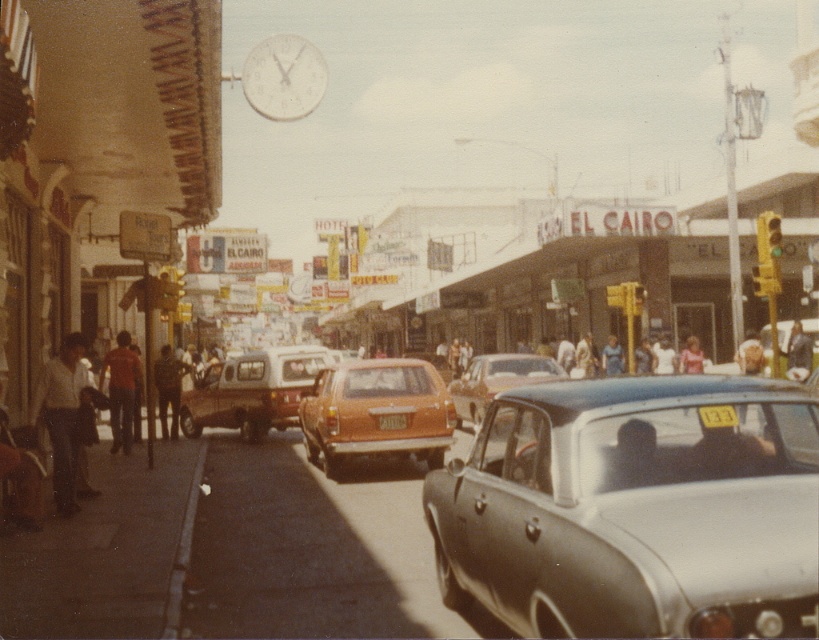
Question: Can you confirm if orange matte station wagon at center is wider than light pink fabric at center?

Choices:
 (A) no
 (B) yes

Answer: (B)

Question: Based on their relative distances, which object is nearer to the dark brown leather jacket at center?

Choices:
 (A) orange shirt at left
 (B) dark blue shirt at center
 (C) light pink fabric at center

Answer: (A)

Question: Does dark brown leather jacket at center have a greater width compared to dark blue shirt at center?

Choices:
 (A) yes
 (B) no

Answer: (B)

Question: Is dark brown leather jacket at center in front of light pink fabric at center?

Choices:
 (A) yes
 (B) no

Answer: (A)

Question: Considering the real-world distances, which object is farthest from the white matte clock at upper center?

Choices:
 (A) dark brown leather jacket at center
 (B) orange shirt at left
 (C) orange matte car at center
 (D) dark blue shirt at center

Answer: (D)

Question: Which of the following is the closest to the observer?

Choices:
 (A) (684, 365)
 (B) (609, 337)

Answer: (A)